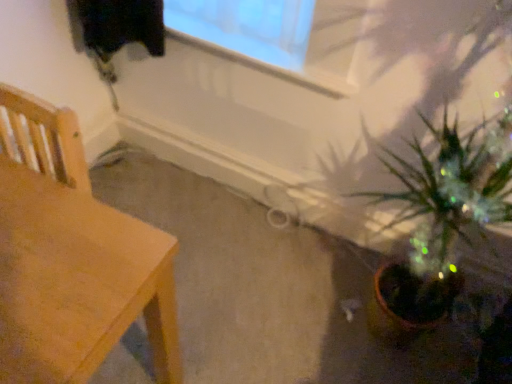
The width and height of the screenshot is (512, 384). In order to click on wooden table at left in this screenshot , I will do `click(72, 258)`.

Measure the distance between wooden table at left and camera.

wooden table at left and camera are 63.40 centimeters apart.

This screenshot has height=384, width=512. What do you see at coordinates (72, 258) in the screenshot? I see `wooden table at left` at bounding box center [72, 258].

At what (x,y) coordinates should I click in order to perform the action: click on wooden table at left. Please return your answer as a coordinate pair (x, y). Looking at the image, I should click on click(x=72, y=258).